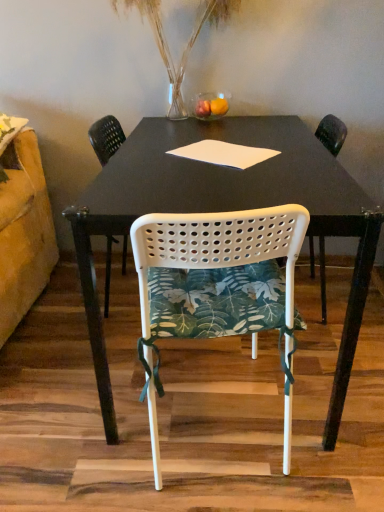
The height and width of the screenshot is (512, 384). Find the location of `white perforated plastic chair at center, placed as the 1th chair when sorted from back to front`. white perforated plastic chair at center, placed as the 1th chair when sorted from back to front is located at coordinates (106, 138).

Measure the distance between translucent glass vase at upper center and camera.

A distance of 5.45 feet exists between translucent glass vase at upper center and camera.

What do you see at coordinates (188, 40) in the screenshot? The image size is (384, 512). I see `translucent glass vase at upper center` at bounding box center [188, 40].

This screenshot has height=512, width=384. What are the coordinates of `white matte table at center` in the screenshot? It's located at (226, 210).

Does white matte table at center appear on the right side of white perforated plastic chair at center, placed as the 1th chair when sorted from back to front?

Yes, white matte table at center is to the right of white perforated plastic chair at center, placed as the 1th chair when sorted from back to front.

Is point (314, 196) farther from camera compared to point (91, 127)?

That is False.

Image resolution: width=384 pixels, height=512 pixels. Find the location of `table on the right of white perforated plastic chair at center, the 2th chair positioned from the front`. table on the right of white perforated plastic chair at center, the 2th chair positioned from the front is located at coordinates (226, 210).

Can you confirm if white paper at center is taller than white matte table at center?

Incorrect, the height of white paper at center is not larger of that of white matte table at center.

Between white paper at center and white matte table at center, which one has larger size?

With larger size is white matte table at center.

Which object is positioned more to the right, white paper at center or white matte table at center?

Positioned to the right is white paper at center.

This screenshot has width=384, height=512. Identify the location of table on the left of white paper at center. [226, 210].

Is white matte table at center next to white perforated plastic chair at center, the 1th chair from the front, and touching it?

No, white matte table at center is not next to white perforated plastic chair at center, the 1th chair from the front.

Could you measure the distance between white matte table at center and white perforated plastic chair at center, the 1th chair from the front?

The distance of white matte table at center from white perforated plastic chair at center, the 1th chair from the front, is 10.36 inches.

Where is `chair below the white matte table at center (from the image's perspective)`? chair below the white matte table at center (from the image's perspective) is located at coordinates (217, 288).

How different are the orientations of white matte table at center and white perforated plastic chair at center, the 1th chair from the front, in degrees?

0.000437 degrees.

Is translucent glass vase at upper center in contact with white matte table at center?

translucent glass vase at upper center and white matte table at center are clearly separated.

From the image's perspective, is translucent glass vase at upper center above white matte table at center?

Indeed, from the image's perspective, translucent glass vase at upper center is shown above white matte table at center.

Where is `plant above the white matte table at center (from the image's perspective)`? The image size is (384, 512). plant above the white matte table at center (from the image's perspective) is located at coordinates (188, 40).

Is translucent glass vase at upper center positioned beyond the bounds of white matte table at center?

That's correct, translucent glass vase at upper center is outside of white matte table at center.

From a real-world perspective, between white matte table at center and white paper at center, who is vertically higher?

From a 3D spatial view, white paper at center is above.

Could you tell me if white matte table at center is turned towards white paper at center?

Yes, white matte table at center is facing white paper at center.

Which is correct: white matte table at center is inside white paper at center, or outside of it?

white matte table at center exists outside the volume of white paper at center.

In the scene shown: In terms of height, does white matte table at center look taller or shorter compared to white paper at center?

Considering their sizes, white matte table at center has more height than white paper at center.

From the image's perspective, relative to white matte table at center, is white perforated plastic chair at center, placed as the 1th chair when sorted from back to front, above or below?

From the image's perspective, white perforated plastic chair at center, placed as the 1th chair when sorted from back to front, appears above white matte table at center.

Can you confirm if white perforated plastic chair at center, the 2th chair positioned from the front, is bigger than white matte table at center?

Incorrect, white perforated plastic chair at center, the 2th chair positioned from the front, is not larger than white matte table at center.

In terms of height, does white perforated plastic chair at center, the 2th chair positioned from the front, look taller or shorter compared to white matte table at center?

Clearly, white perforated plastic chair at center, the 2th chair positioned from the front, is taller compared to white matte table at center.

Does white perforated plastic chair at center, placed as the 1th chair when sorted from back to front, have a greater width compared to white matte table at center?

No.

From a real-world perspective, is translucent glass vase at upper center on white perforated plastic chair at center, marked as the second chair in a back-to-front arrangement?

Yes, from a real-world perspective, translucent glass vase at upper center is over white perforated plastic chair at center, marked as the second chair in a back-to-front arrangement

Considering the points (155, 38) and (230, 226), which point is behind, point (155, 38) or point (230, 226)?

The point (155, 38) is farther.

Which is more to the left, translucent glass vase at upper center or white perforated plastic chair at center, marked as the second chair in a back-to-front arrangement?

Positioned to the left is translucent glass vase at upper center.

Is translucent glass vase at upper center bigger than white perforated plastic chair at center, the 1th chair from the front?

Correct, translucent glass vase at upper center is larger in size than white perforated plastic chair at center, the 1th chair from the front.

You are a GUI agent. You are given a task and a screenshot of the screen. Output one action in this format:
    pyautogui.click(x=<x>, y=<y>)
    Task: Click on the table to the right of white perforated plastic chair at center, placed as the 1th chair when sorted from back to front
    This screenshot has height=512, width=384.
    Given the screenshot: What is the action you would take?
    coord(226,210)

Find the location of `notepad above the white matte table at center (from a real-world perspective)`. notepad above the white matte table at center (from a real-world perspective) is located at coordinates (224, 154).

When comparing their distances from white matte table at center, does white perforated plastic chair at center, the 2th chair positioned from the front, or translucent glass vase at upper center seem further?

Among the two, translucent glass vase at upper center is located further to white matte table at center.

Which object lies further to the anchor point white paper at center, white perforated plastic chair at center, placed as the 1th chair when sorted from back to front, or white perforated plastic chair at center, marked as the second chair in a back-to-front arrangement?

white perforated plastic chair at center, placed as the 1th chair when sorted from back to front, is further to white paper at center.

Looking at this image, which object lies further to the anchor point white paper at center, white perforated plastic chair at center, marked as the second chair in a back-to-front arrangement, or white perforated plastic chair at center, placed as the 1th chair when sorted from back to front?

white perforated plastic chair at center, placed as the 1th chair when sorted from back to front, is positioned further to the anchor white paper at center.

Which object lies further to the anchor point translucent glass vase at upper center, white perforated plastic chair at center, the 1th chair from the front, or white matte table at center?

Among the two, white perforated plastic chair at center, the 1th chair from the front, is located further to translucent glass vase at upper center.

Considering their positions, is white matte table at center positioned further to white perforated plastic chair at center, marked as the second chair in a back-to-front arrangement, than white paper at center?

white paper at center is positioned further to the anchor white perforated plastic chair at center, marked as the second chair in a back-to-front arrangement.

Looking at the image, which one is located further to white paper at center, white matte table at center or white perforated plastic chair at center, the 1th chair from the front?

The object further to white paper at center is white perforated plastic chair at center, the 1th chair from the front.

From the image, which object appears to be farther from white perforated plastic chair at center, placed as the 1th chair when sorted from back to front, white perforated plastic chair at center, marked as the second chair in a back-to-front arrangement, or translucent glass vase at upper center?

white perforated plastic chair at center, marked as the second chair in a back-to-front arrangement, lies further to white perforated plastic chair at center, placed as the 1th chair when sorted from back to front, than the other object.

When comparing their distances from white matte table at center, does white perforated plastic chair at center, the 2th chair positioned from the front, or white perforated plastic chair at center, the 1th chair from the front, seem further?

white perforated plastic chair at center, the 2th chair positioned from the front.

The height and width of the screenshot is (512, 384). What are the coordinates of `chair located between white matte table at center and white perforated plastic chair at center, the 2th chair positioned from the front, in the depth direction` in the screenshot? It's located at (217, 288).

Identify the location of notepad between translucent glass vase at upper center and white perforated plastic chair at center, the 2th chair positioned from the front, vertically. The image size is (384, 512). (224, 154).

The width and height of the screenshot is (384, 512). In order to click on notepad between white matte table at center and white perforated plastic chair at center, placed as the 1th chair when sorted from back to front, in the front-back direction in this screenshot , I will do `click(224, 154)`.

Identify the location of notepad between translucent glass vase at upper center and white matte table at center in the up-down direction. (224, 154).